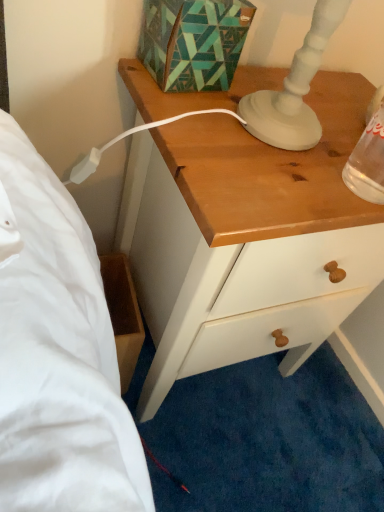
In order to click on wooden nightstand at upper right in this screenshot , I will do tap(246, 238).

This screenshot has height=512, width=384. Describe the element at coordinates (246, 238) in the screenshot. I see `wooden nightstand at upper right` at that location.

You are a GUI agent. You are given a task and a screenshot of the screen. Output one action in this format:
    pyautogui.click(x=<x>, y=<y>)
    Task: Click on the wooden nightstand at upper right
    
    Given the screenshot: What is the action you would take?
    pyautogui.click(x=246, y=238)